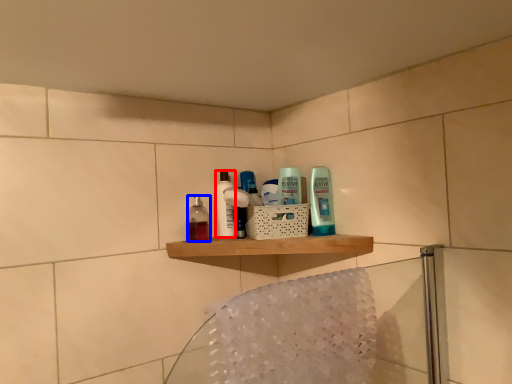
Question: Which object appears farthest to the camera in this image, toiletry (highlighted by a red box) or mouthwash (highlighted by a blue box)?

Choices:
 (A) toiletry
 (B) mouthwash

Answer: (A)